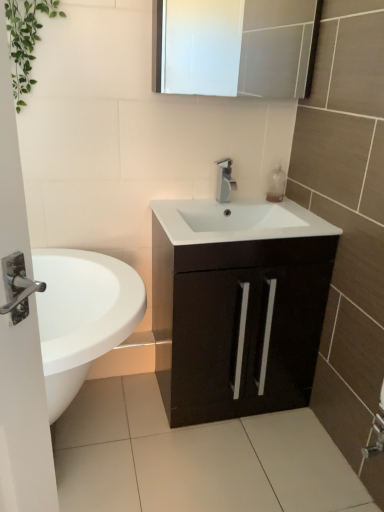
The image size is (384, 512). I want to click on vacant region below white glossy medicine cabinet at upper center (from a real-world perspective), so click(206, 200).